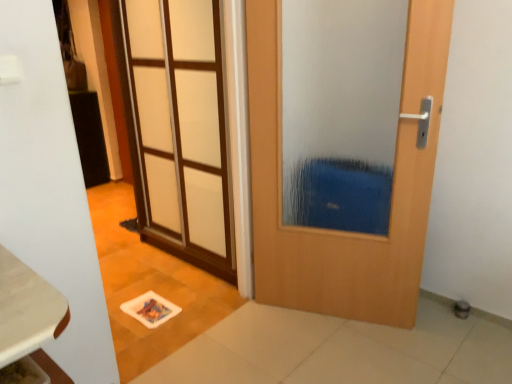
The image size is (512, 384). Describe the element at coordinates (28, 324) in the screenshot. I see `wooden table at lower left` at that location.

Measure the distance between wooden door at center, which is counted as the first door, starting from the right, and camera.

The distance of wooden door at center, which is counted as the first door, starting from the right, from camera is 5.29 feet.

Locate an element on the screen. This screenshot has width=512, height=384. wooden table at lower left is located at coordinates (28, 324).

Could you tell me if wooden table at lower left is turned towards wooden door at center, which is counted as the first door, starting from the right?

No, wooden table at lower left is not oriented towards wooden door at center, which is counted as the first door, starting from the right.

From a real-world perspective, is wooden table at lower left below wooden door at center, the second door viewed from the left?

Yes, from a real-world perspective, wooden table at lower left is below wooden door at center, the second door viewed from the left.

Is point (11, 308) positioned after point (255, 251)?

No, (11, 308) is closer to viewer.

How far apart are wooden door at center, the second door viewed from the left, and white frosted glass door at upper left, which is counted as the first door, starting from the left?

wooden door at center, the second door viewed from the left, and white frosted glass door at upper left, which is counted as the first door, starting from the left, are 25.41 inches apart from each other.

Considering the sizes of objects wooden door at center, the second door viewed from the left, and white frosted glass door at upper left, which is counted as the 2th door, starting from the right, in the image provided, who is shorter, wooden door at center, the second door viewed from the left, or white frosted glass door at upper left, which is counted as the 2th door, starting from the right,?

Standing shorter between the two is wooden door at center, the second door viewed from the left.

Is wooden door at center, which is counted as the first door, starting from the right, not within white frosted glass door at upper left, which is counted as the first door, starting from the left?

Indeed, wooden door at center, which is counted as the first door, starting from the right, is completely outside white frosted glass door at upper left, which is counted as the first door, starting from the left.

Can you tell me how much wooden door at center, the second door viewed from the left, and white frosted glass door at upper left, which is counted as the first door, starting from the left, differ in facing direction?

The angular difference between wooden door at center, the second door viewed from the left, and white frosted glass door at upper left, which is counted as the first door, starting from the left, is 24.4 degrees.

Considering the relative sizes of wooden table at lower left and white frosted glass door at upper left, which is counted as the first door, starting from the left, in the image provided, is wooden table at lower left shorter than white frosted glass door at upper left, which is counted as the first door, starting from the left,?

Yes, wooden table at lower left is shorter than white frosted glass door at upper left, which is counted as the first door, starting from the left.

Can you confirm if wooden table at lower left is wider than white frosted glass door at upper left, which is counted as the 2th door, starting from the right?

Correct, the width of wooden table at lower left exceeds that of white frosted glass door at upper left, which is counted as the 2th door, starting from the right.

Considering the sizes of wooden table at lower left and white frosted glass door at upper left, which is counted as the 2th door, starting from the right, in the image, is wooden table at lower left bigger or smaller than white frosted glass door at upper left, which is counted as the 2th door, starting from the right,?

Clearly, wooden table at lower left is smaller in size than white frosted glass door at upper left, which is counted as the 2th door, starting from the right.

Which is in front, wooden table at lower left or white frosted glass door at upper left, which is counted as the first door, starting from the left?

wooden table at lower left is in front.

Is wooden door at center, which is counted as the first door, starting from the right, beside wooden table at lower left?

No, wooden door at center, which is counted as the first door, starting from the right, is not touching wooden table at lower left.

Which is farther, (252, 83) or (60, 320)?

Positioned behind is point (252, 83).

Who is shorter, wooden door at center, the second door viewed from the left, or wooden table at lower left?

With less height is wooden table at lower left.

Would you say white frosted glass door at upper left, which is counted as the 2th door, starting from the right, is outside wooden table at lower left?

Yes, white frosted glass door at upper left, which is counted as the 2th door, starting from the right, is located beyond the bounds of wooden table at lower left.

What's the angular difference between white frosted glass door at upper left, which is counted as the 2th door, starting from the right, and wooden table at lower left's facing directions?

The angle between the facing direction of white frosted glass door at upper left, which is counted as the 2th door, starting from the right, and the facing direction of wooden table at lower left is 89.3 degrees.

From a real-world perspective, is white frosted glass door at upper left, which is counted as the first door, starting from the left, over wooden table at lower left?

Yes, from a real-world perspective, white frosted glass door at upper left, which is counted as the first door, starting from the left, is above wooden table at lower left.

Is white frosted glass door at upper left, which is counted as the 2th door, starting from the right, aimed at wooden table at lower left?

No.

From a real-world perspective, which object stands above the other?

From a 3D spatial view, white frosted glass door at upper left, which is counted as the 2th door, starting from the right, is above.

Is white frosted glass door at upper left, which is counted as the first door, starting from the left, in front of wooden door at center, the second door viewed from the left?

No, white frosted glass door at upper left, which is counted as the first door, starting from the left, is further to the viewer.

Is point (221, 71) closer to camera compared to point (384, 294)?

Yes.

Identify the location of door that is the 2nd one when counting rightward from the wooden table at lower left. The height and width of the screenshot is (384, 512). [x=340, y=231].

The image size is (512, 384). I want to click on door above the wooden door at center, the second door viewed from the left (from the image's perspective), so click(177, 127).

Considering their positions, is wooden door at center, which is counted as the first door, starting from the right, positioned closer to white frosted glass door at upper left, which is counted as the 2th door, starting from the right, than wooden table at lower left?

Among the two, wooden door at center, which is counted as the first door, starting from the right, is located nearer to white frosted glass door at upper left, which is counted as the 2th door, starting from the right.

Which object lies further to the anchor point wooden door at center, the second door viewed from the left, wooden table at lower left or white frosted glass door at upper left, which is counted as the first door, starting from the left?

wooden table at lower left is positioned further to the anchor wooden door at center, the second door viewed from the left.

From the image, which object appears to be farther from white frosted glass door at upper left, which is counted as the 2th door, starting from the right, wooden table at lower left or wooden door at center, which is counted as the first door, starting from the right?

The object further to white frosted glass door at upper left, which is counted as the 2th door, starting from the right, is wooden table at lower left.

Which object lies further to the anchor point wooden table at lower left, wooden door at center, the second door viewed from the left, or white frosted glass door at upper left, which is counted as the first door, starting from the left?

The object further to wooden table at lower left is white frosted glass door at upper left, which is counted as the first door, starting from the left.

Estimate the real-world distances between objects in this image. Which object is further from wooden door at center, which is counted as the first door, starting from the right, white frosted glass door at upper left, which is counted as the first door, starting from the left, or wooden table at lower left?

Among the two, wooden table at lower left is located further to wooden door at center, which is counted as the first door, starting from the right.

Estimate the real-world distances between objects in this image. Which object is closer to wooden table at lower left, white frosted glass door at upper left, which is counted as the first door, starting from the left, or wooden door at center, the second door viewed from the left?

wooden door at center, the second door viewed from the left.

Image resolution: width=512 pixels, height=384 pixels. Find the location of `door between wooden table at lower left and white frosted glass door at upper left, which is counted as the 2th door, starting from the right, from front to back`. door between wooden table at lower left and white frosted glass door at upper left, which is counted as the 2th door, starting from the right, from front to back is located at coordinates (340, 231).